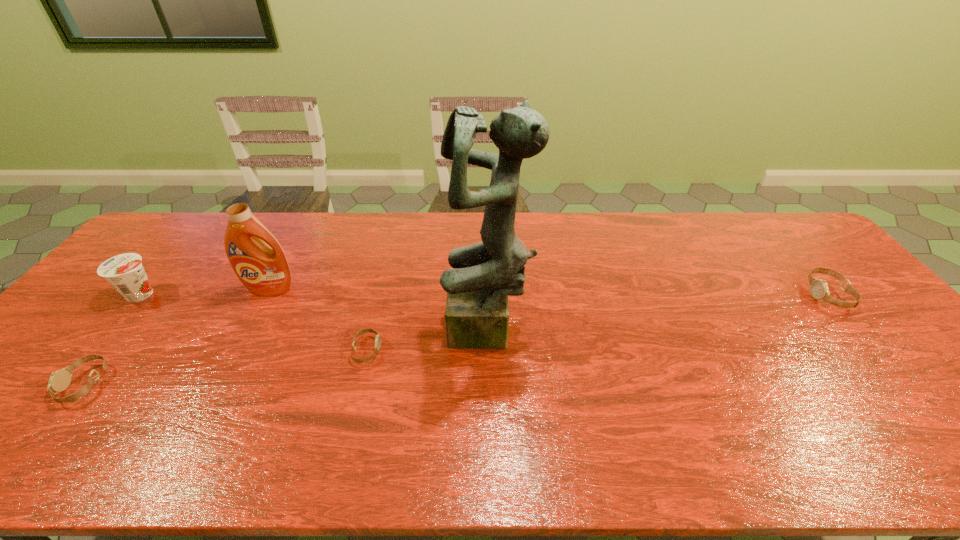
Locate an element on the screen. The image size is (960, 540). the fifth tallest object is located at coordinates (59, 380).

Where is `the leftmost watch`? the leftmost watch is located at coordinates (59, 380).

Where is `the second watch from left to right`? This screenshot has height=540, width=960. the second watch from left to right is located at coordinates (368, 330).

In order to click on the shortest watch in this screenshot , I will do `click(368, 330)`.

Find the location of `the farthest watch`. the farthest watch is located at coordinates (819, 290).

Locate an element on the screen. This screenshot has width=960, height=540. the rightmost object is located at coordinates pyautogui.click(x=819, y=290).

Identify the location of detergent. (264, 270).

I want to click on the third object from left to right, so click(x=264, y=270).

Where is `sculpture`? sculpture is located at coordinates (477, 314).

At what (x,y) coordinates should I click in order to perform the action: click on the tallest object. Please return your answer as a coordinate pair (x, y). The width and height of the screenshot is (960, 540). Looking at the image, I should click on (477, 314).